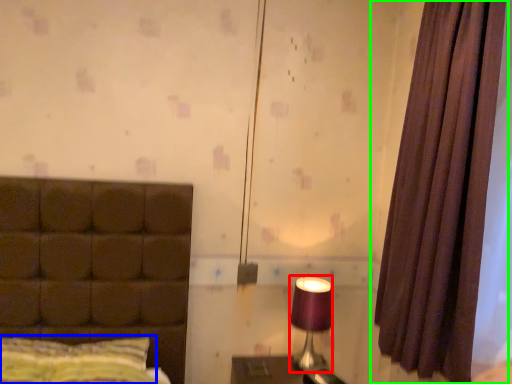
Question: Which is farther away from table lamp (highlighted by a red box)? pillow (highlighted by a blue box) or curtain (highlighted by a green box)?

Choices:
 (A) pillow
 (B) curtain

Answer: (A)